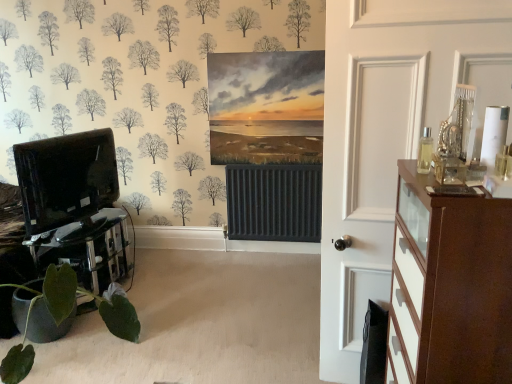
This screenshot has width=512, height=384. Describe the element at coordinates (449, 285) in the screenshot. I see `brown wood chest of drawers at right` at that location.

In order to face green matte plant at lower left, should I rotate leftwards or rightwards?

To align with it, rotate left about 25.997°.

This screenshot has width=512, height=384. What do you see at coordinates (68, 316) in the screenshot?
I see `green matte plant at lower left` at bounding box center [68, 316].

Image resolution: width=512 pixels, height=384 pixels. Find the location of `black glossy entertainment center at left`. black glossy entertainment center at left is located at coordinates (74, 205).

The image size is (512, 384). Describe the element at coordinates (74, 205) in the screenshot. I see `black glossy entertainment center at left` at that location.

At what (x,y) coordinates should I click in order to perform the action: click on white glossy door at right. Please return your answer as a coordinate pair (x, y). The width and height of the screenshot is (512, 384). Looking at the image, I should click on (390, 134).

Considering the relative sizes of black glass table at lower left and white glossy door at right in the image provided, is black glass table at lower left wider than white glossy door at right?

Indeed, black glass table at lower left has a greater width compared to white glossy door at right.

Does black glass table at lower left appear on the right side of white glossy door at right?

In fact, black glass table at lower left is to the left of white glossy door at right.

From the image's perspective, is black glass table at lower left on top of white glossy door at right?

No, from the image's perspective, black glass table at lower left is not over white glossy door at right.

Is brown wood chest of drawers at right next to green matte plant at lower left and touching it?

They are not placed beside each other.

Between point (405, 300) and point (11, 350), which one is positioned in front?

The point (405, 300) is more forward.

Considering the sizes of objects brown wood chest of drawers at right and green matte plant at lower left in the image provided, who is thinner, brown wood chest of drawers at right or green matte plant at lower left?

With smaller width is brown wood chest of drawers at right.

What are the coordinates of `houseplant that is behind the brown wood chest of drawers at right` in the screenshot? It's located at (68, 316).

Can you tell me how much black glass table at lower left and green matte plant at lower left differ in facing direction?

The angular difference between black glass table at lower left and green matte plant at lower left is 1.12e-05 degrees.

Is black glass table at lower left in front of or behind green matte plant at lower left in the image?

In the image, black glass table at lower left appears behind green matte plant at lower left.

Which point is more forward, (81, 280) or (114, 297)?

Point (114, 297)

From a real-world perspective, is black glass table at lower left beneath green matte plant at lower left?

Yes, from a real-world perspective, black glass table at lower left is under green matte plant at lower left.

From the image's perspective, which is below, green matte plant at lower left or black glossy entertainment center at left?

green matte plant at lower left is shown below in the image.

Which is behind, green matte plant at lower left or black glossy entertainment center at left?

black glossy entertainment center at left.

Considering the points (6, 372) and (50, 188), which point is in front, point (6, 372) or point (50, 188)?

The point (6, 372) is more forward.

Locate an element on the screen. entertainment center behind the green matte plant at lower left is located at coordinates (74, 205).

Is black glass table at lower left in contact with black glossy entertainment center at left?

There is a gap between black glass table at lower left and black glossy entertainment center at left.

Who is taller, black glass table at lower left or black glossy entertainment center at left?

Standing taller between the two is black glossy entertainment center at left.

Measure the distance from black glass table at lower left to black glossy entertainment center at left.

black glass table at lower left is 12.38 centimeters away from black glossy entertainment center at left.

How many degrees apart are the facing directions of black glass table at lower left and black glossy entertainment center at left?

black glass table at lower left and black glossy entertainment center at left are facing 170 degrees away from each other.

Who is more distant, white glossy door at right or brown wood chest of drawers at right?

white glossy door at right is further from the camera.

Is white glossy door at right not near brown wood chest of drawers at right?

That's not correct — white glossy door at right is a little close to brown wood chest of drawers at right.

Locate an element on the screen. The height and width of the screenshot is (384, 512). chest of drawers on the right of white glossy door at right is located at coordinates (449, 285).

Is white glossy door at right facing away from brown wood chest of drawers at right?

Yes, brown wood chest of drawers at right is at the back of white glossy door at right.

From a real-world perspective, between brown wood chest of drawers at right and black glass table at lower left, who is vertically lower?

black glass table at lower left, from a real-world perspective.

Is brown wood chest of drawers at right far away from black glass table at lower left?

brown wood chest of drawers at right is far away from black glass table at lower left.

Between point (454, 298) and point (106, 244), which one is positioned in front?

The point (454, 298) is closer to the camera.

Can you tell me how much brown wood chest of drawers at right and black glass table at lower left differ in facing direction?

There is a 180-degree angle between the facing directions of brown wood chest of drawers at right and black glass table at lower left.

Locate an element on the screen. Image resolution: width=512 pixels, height=384 pixels. table that appears below the white glossy door at right (from the image's perspective) is located at coordinates (88, 250).

Locate an element on the screen. The width and height of the screenshot is (512, 384). chest of drawers on the right of green matte plant at lower left is located at coordinates (449, 285).

Which object lies nearer to the anchor point black glass table at lower left, brown wood chest of drawers at right or white glossy door at right?

white glossy door at right is closer to black glass table at lower left.

Which object lies nearer to the anchor point green matte plant at lower left, black glossy entertainment center at left or black glass table at lower left?

Among the two, black glass table at lower left is located nearer to green matte plant at lower left.

Considering their positions, is brown wood chest of drawers at right positioned closer to white glossy door at right than black glass table at lower left?

Among the two, brown wood chest of drawers at right is located nearer to white glossy door at right.

Considering their positions, is black glass table at lower left positioned further to black glossy entertainment center at left than brown wood chest of drawers at right?

brown wood chest of drawers at right lies further to black glossy entertainment center at left than the other object.

Looking at the image, which one is located further to brown wood chest of drawers at right, black glossy entertainment center at left or green matte plant at lower left?

The object further to brown wood chest of drawers at right is black glossy entertainment center at left.

Consider the image. Considering their positions, is green matte plant at lower left positioned closer to black glossy entertainment center at left than white glossy door at right?

Based on the image, green matte plant at lower left appears to be nearer to black glossy entertainment center at left.

Estimate the real-world distances between objects in this image. Which object is closer to black glass table at lower left, green matte plant at lower left or brown wood chest of drawers at right?

green matte plant at lower left is positioned closer to the anchor black glass table at lower left.

Which object lies nearer to the anchor point white glossy door at right, black glossy entertainment center at left or black glass table at lower left?

Based on the image, black glass table at lower left appears to be nearer to white glossy door at right.

Identify the location of door situated between black glass table at lower left and brown wood chest of drawers at right from left to right. (390, 134).

Identify the location of entertainment center between green matte plant at lower left and brown wood chest of drawers at right. This screenshot has height=384, width=512. (74, 205).

This screenshot has width=512, height=384. Identify the location of door between black glossy entertainment center at left and brown wood chest of drawers at right from left to right. pyautogui.click(x=390, y=134).

What are the coordinates of `entertainment center between black glass table at lower left and brown wood chest of drawers at right` in the screenshot? It's located at (74, 205).